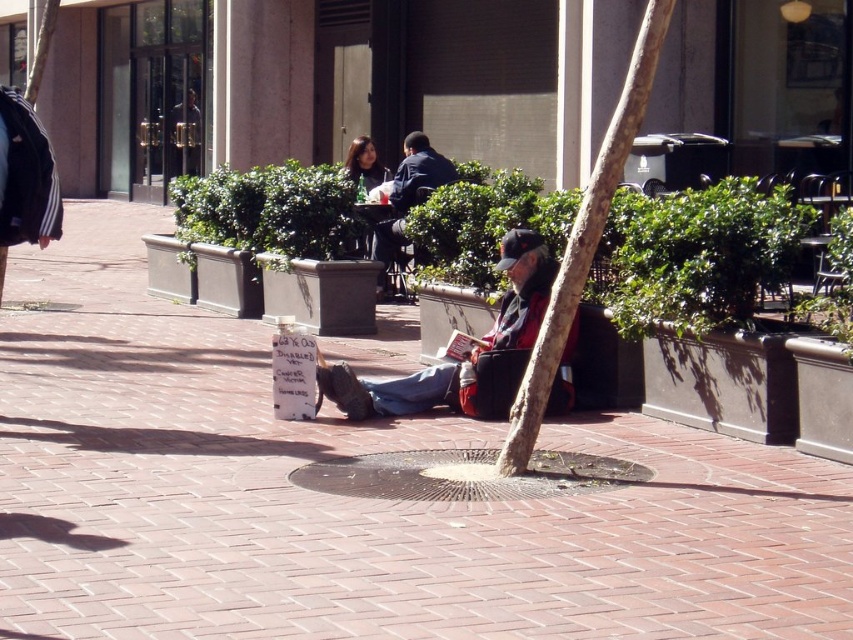
You are a delivery person who needs to place a package on the brick pavement at center without getting too close to the green leafy tree at center. The package requires a minimum of 3 meters of space from the tree. Can you safely place the package there?

The brick pavement at center is 3.54 meters away from the green leafy tree at center. Since the required minimum distance is 3 meters, placing the package there would be safe as the distance is sufficient.

You are standing in the pedestrian plaza and want to find the green leafy tree at center. According to the scene description, where would you look to locate it?

The green leafy tree at center is located at point (583, 241).

From the picture: You are a city planner assessing the safety of the pedestrian plaza. You notice a metallic gray manhole cover at center and a red plaid shirt at center. Which object has a greater width?

The metallic gray manhole cover at center has a greater width than the red plaid shirt at center.